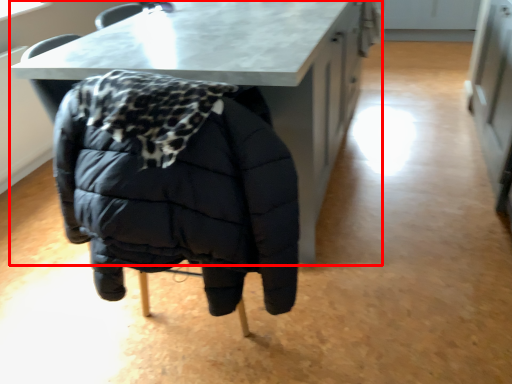
Question: Observing the image, what is the correct spatial positioning of table (annotated by the red box) in reference to jacket?

Choices:
 (A) left
 (B) right

Answer: (B)